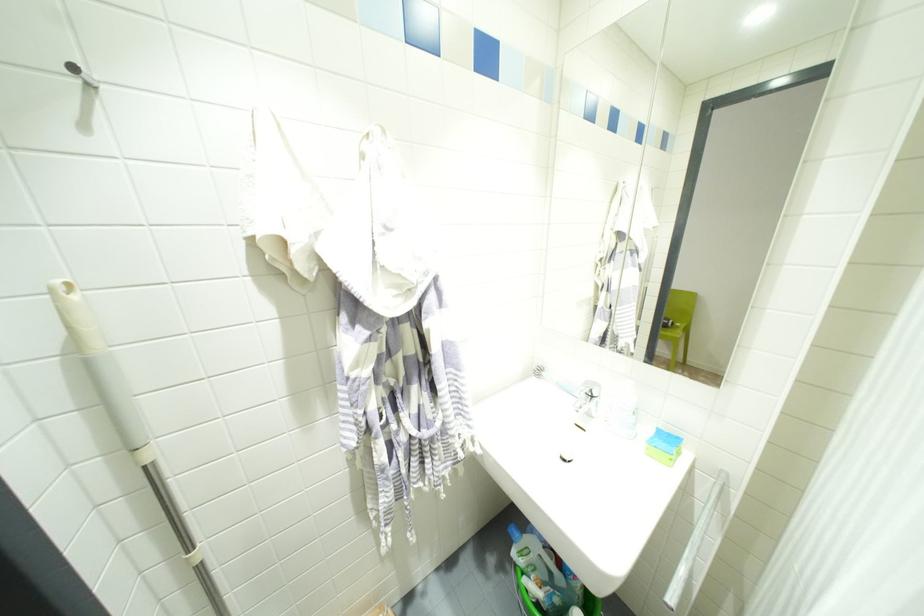
This screenshot has height=616, width=924. Describe the element at coordinates (588, 398) in the screenshot. I see `the faucet handle` at that location.